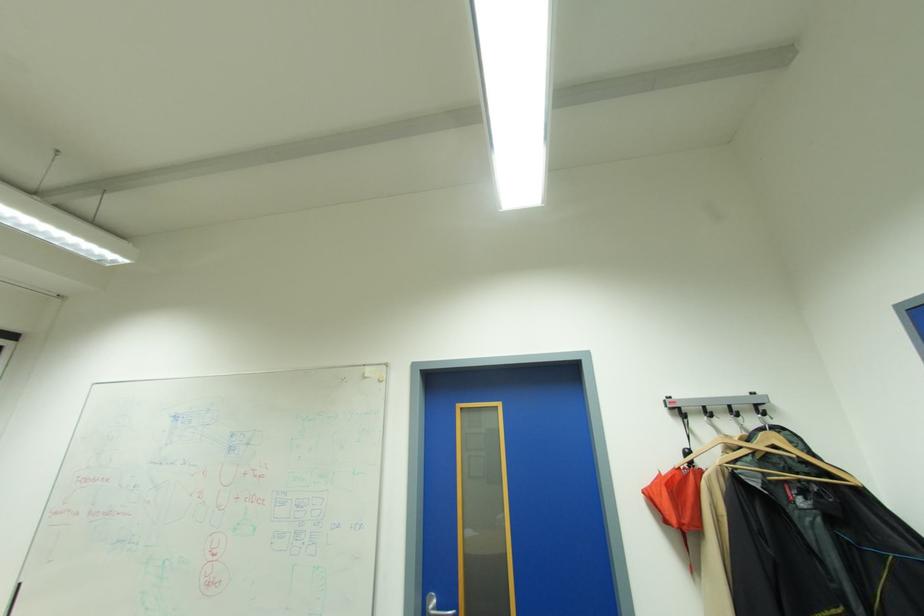
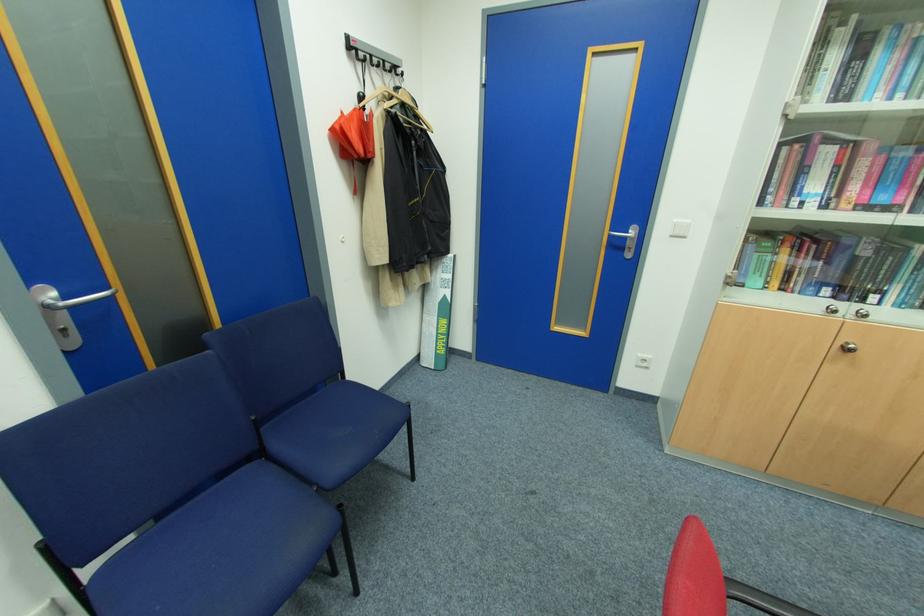
In the second image, find the point that corresponds to point (676, 415) in the first image.

(353, 55)